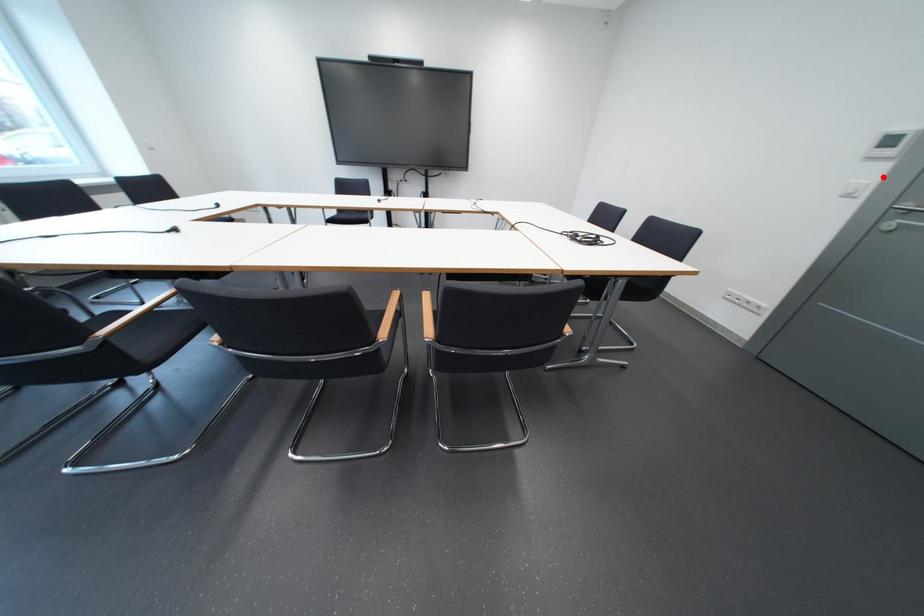
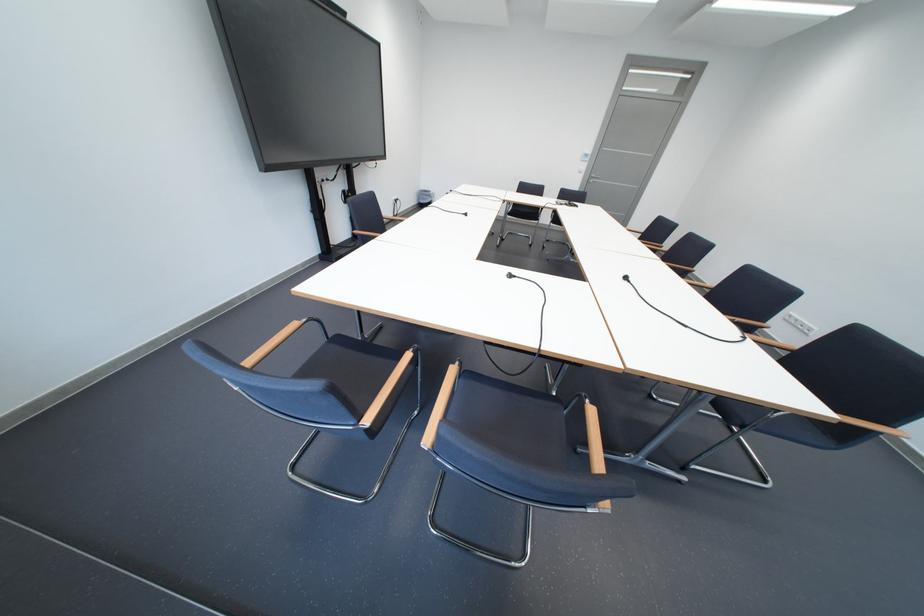
Question: I am providing you with two images of the same scene from different viewpoints. In image1, a red point is highlighted. Considering the same 3D point in image2, which of the following is correct?

Choices:
 (A) It is closer
 (B) It is farther

Answer: (A)